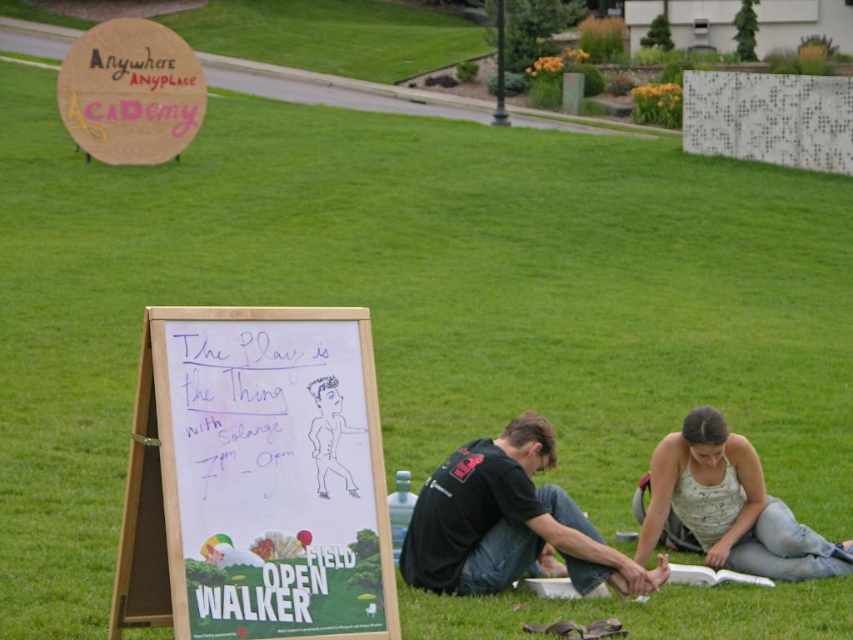
Question: From the image, what is the correct spatial relationship of black matte t-shirt at lower center in relation to wooden signboard at upper left?

Choices:
 (A) above
 (B) below

Answer: (B)

Question: Which point is farther to the camera?

Choices:
 (A) pos(160,157)
 (B) pos(729,560)
 (C) pos(454,556)

Answer: (A)

Question: Which point is closer to the camera?

Choices:
 (A) white wood easel at center
 (B) black matte t-shirt at lower center

Answer: (A)

Question: Among these points, which one is farthest from the camera?

Choices:
 (A) (578, 513)
 (B) (341, 616)
 (C) (177, 132)
 (D) (717, 452)

Answer: (C)

Question: Does black matte t-shirt at lower center have a larger size compared to wooden signboard at upper left?

Choices:
 (A) yes
 (B) no

Answer: (B)

Question: Can you confirm if white wood easel at center is wider than black matte t-shirt at lower center?

Choices:
 (A) no
 (B) yes

Answer: (A)